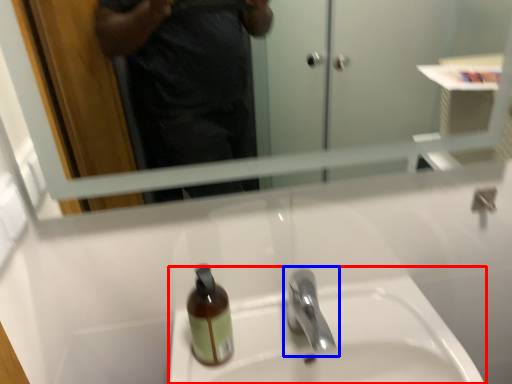
Question: Among these objects, which one is nearest to the camera, sink (highlighted by a red box) or tap (highlighted by a blue box)?

Choices:
 (A) sink
 (B) tap

Answer: (B)